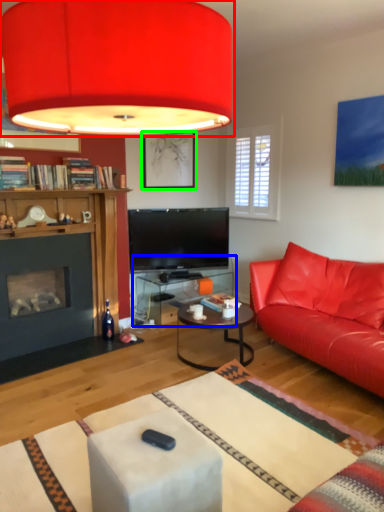
Question: Considering the real-world distances, which object is closest to lamp (highlighted by a red box)? table (highlighted by a blue box) or picture frame (highlighted by a green box).

Choices:
 (A) table
 (B) picture frame

Answer: (B)